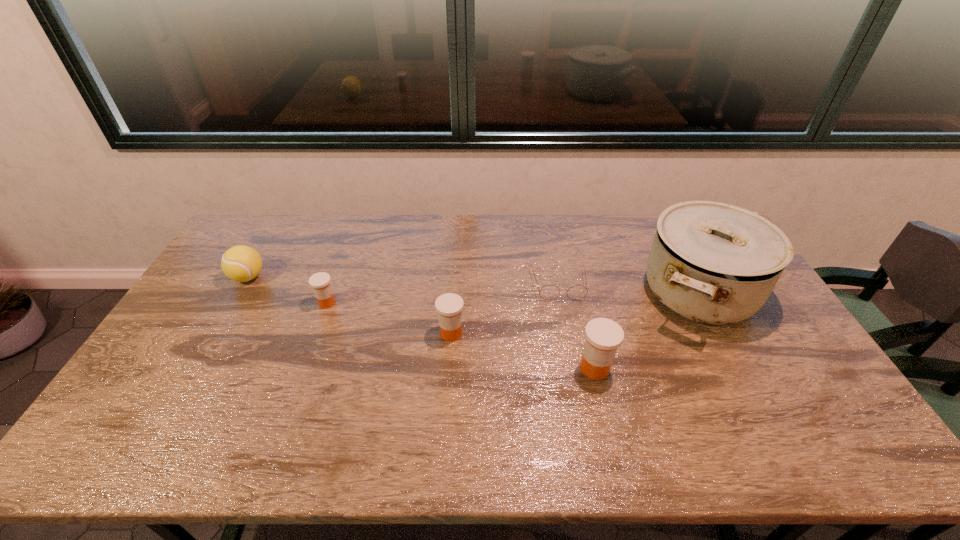
The width and height of the screenshot is (960, 540). In order to click on the leftmost medicine in this screenshot , I will do `click(320, 282)`.

I want to click on the shortest medicine, so click(320, 282).

At what (x,y) coordinates should I click in order to perform the action: click on the second nearest medicine. Please return your answer as a coordinate pair (x, y). Looking at the image, I should click on (449, 306).

Locate an element on the screen. the second shortest medicine is located at coordinates (449, 306).

Find the location of a particular element. the nearest medicine is located at coordinates (603, 336).

Where is `the nearest object`? The width and height of the screenshot is (960, 540). the nearest object is located at coordinates (603, 336).

Where is `saucepan`? This screenshot has width=960, height=540. saucepan is located at coordinates (714, 263).

The image size is (960, 540). I want to click on the tallest object, so click(714, 263).

The height and width of the screenshot is (540, 960). In order to click on tennis ball in this screenshot , I will do `click(241, 263)`.

Locate an element on the screen. This screenshot has height=540, width=960. spectacles is located at coordinates (549, 292).